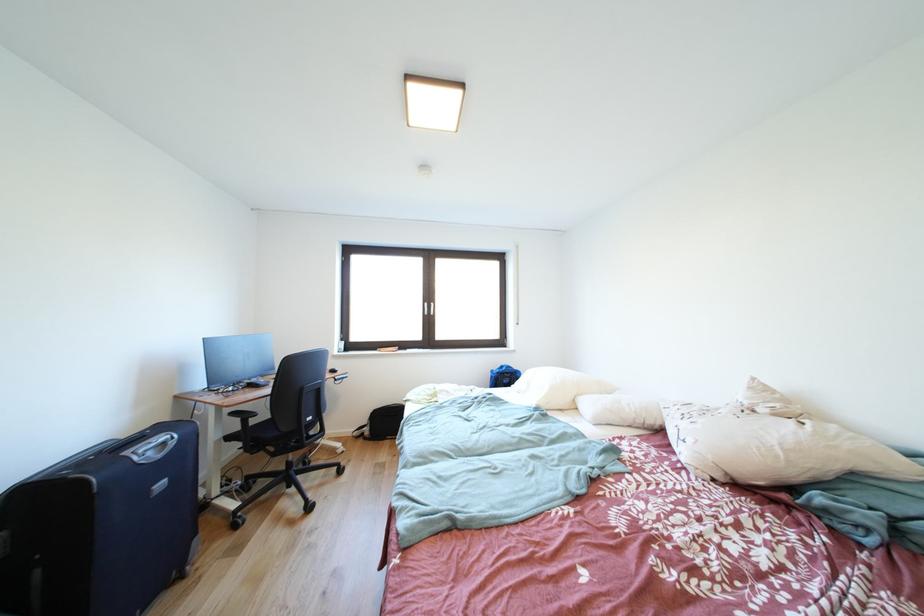
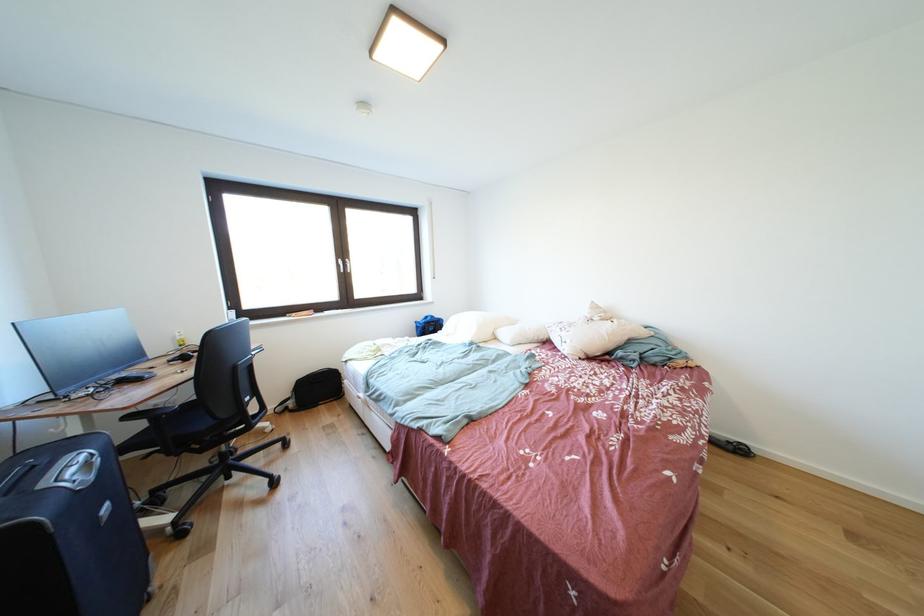
Locate, in the second image, the point that corresponds to the point at 524,371 in the first image.

(445, 321)